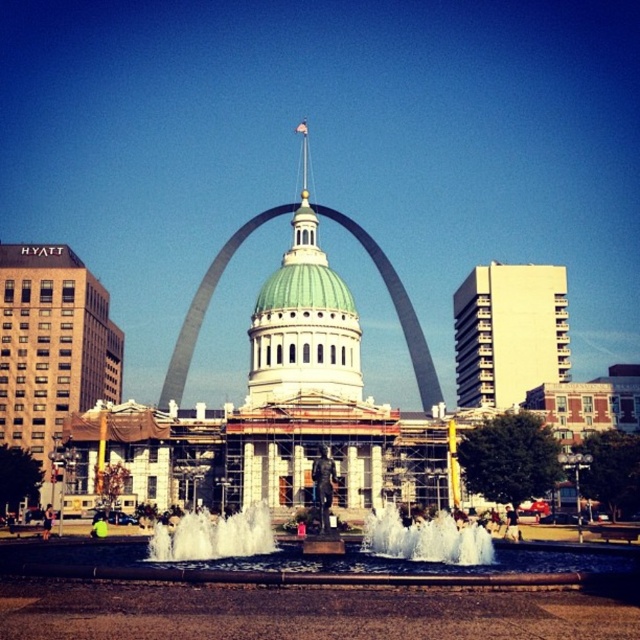
Which of these two, green dome at center or white frothy water at center, stands shorter?

white frothy water at center

Who is more forward, (291,301) or (442,552)?

Point (442,552)

Between point (344, 353) and point (369, 525), which one is positioned in front?

Point (369, 525) is more forward.

Locate an element on the screen. Image resolution: width=640 pixels, height=640 pixels. green dome at center is located at coordinates (304, 320).